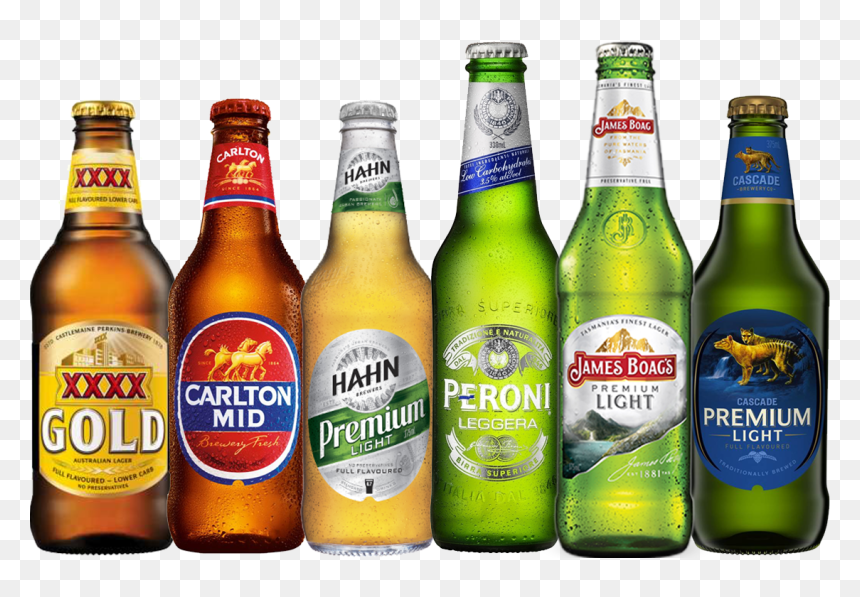
This screenshot has width=860, height=597. I want to click on beer bottles, so click(x=84, y=389), click(x=234, y=399), click(x=371, y=398), click(x=494, y=392), click(x=598, y=401), click(x=725, y=404).